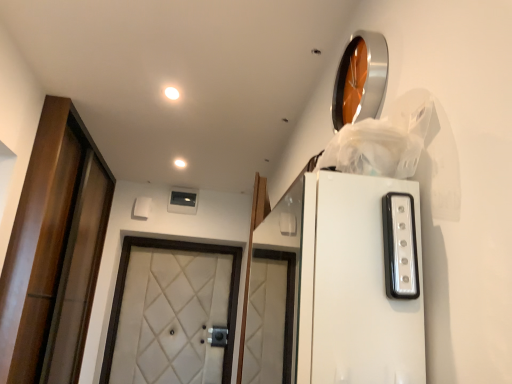
Question: Can you confirm if white matte light fixture at upper center, which is the 1th lighting from left to right, is taller than white glossy light strip at upper right?

Choices:
 (A) no
 (B) yes

Answer: (A)

Question: From a real-world perspective, is white matte light fixture at upper center, the first lighting from the back, below white glossy light strip at upper right?

Choices:
 (A) yes
 (B) no

Answer: (B)

Question: Can you confirm if white matte light fixture at upper center, positioned as the second lighting in top-to-bottom order, is bigger than white glossy light strip at upper right?

Choices:
 (A) yes
 (B) no

Answer: (B)

Question: Is white matte light fixture at upper center, marked as the second lighting in a front-to-back arrangement, positioned behind white glossy light strip at upper right?

Choices:
 (A) yes
 (B) no

Answer: (A)

Question: Are white matte light fixture at upper center, which is the 1th lighting from left to right, and white glossy light strip at upper right beside each other?

Choices:
 (A) yes
 (B) no

Answer: (B)

Question: From the image's perspective, is white glossy light strip at upper right located above or below matte white light fixture at upper center, which is the 1th lighting from front to back?

Choices:
 (A) above
 (B) below

Answer: (B)

Question: Would you say white glossy light strip at upper right is to the left or to the right of matte white light fixture at upper center, the second lighting when ordered from bottom to top, in the picture?

Choices:
 (A) right
 (B) left

Answer: (A)

Question: Is point (401, 281) closer or farther from the camera than point (172, 92)?

Choices:
 (A) closer
 (B) farther

Answer: (A)

Question: Is white glossy light strip at upper right in front of or behind matte white light fixture at upper center, which appears as the second lighting when viewed from the left, in the image?

Choices:
 (A) behind
 (B) front

Answer: (B)

Question: From a real-world perspective, relative to matte white light fixture at upper center, acting as the first lighting starting from the top, is white matte light fixture at upper center, acting as the 2th lighting starting from the right, vertically above or below?

Choices:
 (A) above
 (B) below

Answer: (A)

Question: In terms of width, does white matte light fixture at upper center, acting as the 2th lighting starting from the right, look wider or thinner when compared to matte white light fixture at upper center, acting as the first lighting starting from the top?

Choices:
 (A) thin
 (B) wide

Answer: (B)

Question: Is white matte light fixture at upper center, the 1th lighting positioned from the bottom, spatially inside matte white light fixture at upper center, which is the 1th lighting from front to back, or outside of it?

Choices:
 (A) inside
 (B) outside

Answer: (B)

Question: Considering the positions of point pyautogui.click(x=182, y=160) and point pyautogui.click(x=169, y=94), is point pyautogui.click(x=182, y=160) closer or farther from the camera than point pyautogui.click(x=169, y=94)?

Choices:
 (A) farther
 (B) closer

Answer: (A)

Question: Is white matte light fixture at upper center, acting as the 2th lighting starting from the right, taller or shorter than white glossy light strip at upper right?

Choices:
 (A) short
 (B) tall

Answer: (A)

Question: From a real-world perspective, is white matte light fixture at upper center, marked as the second lighting in a front-to-back arrangement, positioned above or below white glossy light strip at upper right?

Choices:
 (A) above
 (B) below

Answer: (A)